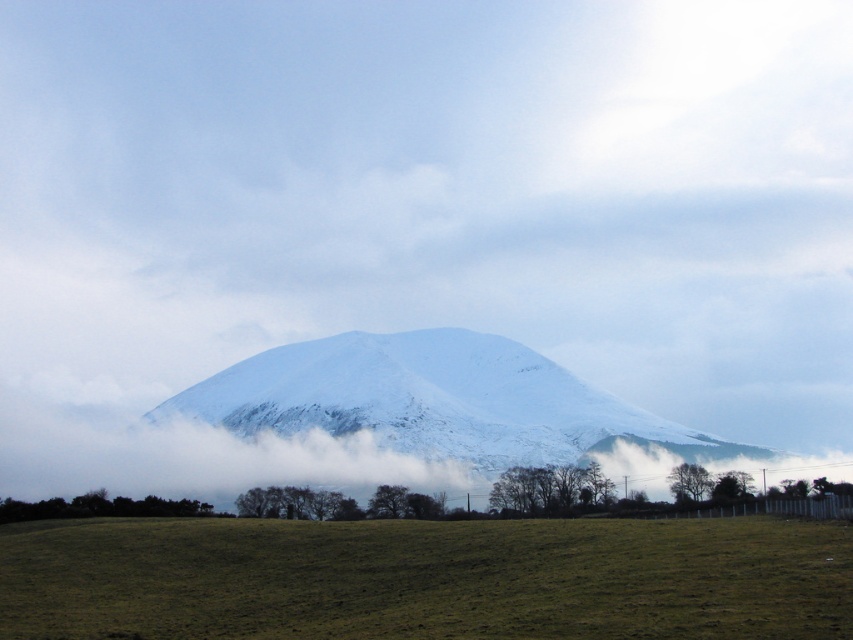
Question: Is green grassy field at lower center to the left of white snow-covered mountain at center from the viewer's perspective?

Choices:
 (A) no
 (B) yes

Answer: (A)

Question: Is green grassy field at lower center wider than white snow-covered mountain at center?

Choices:
 (A) no
 (B) yes

Answer: (A)

Question: Which of the following is the closest to the observer?

Choices:
 (A) green grassy field at lower center
 (B) white snow-covered mountain at center

Answer: (A)

Question: Does green grassy field at lower center have a greater width compared to white snow-covered mountain at center?

Choices:
 (A) no
 (B) yes

Answer: (A)